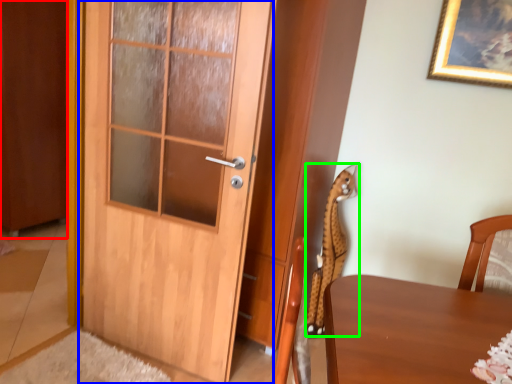
Question: Considering the real-world distances, which object is farthest from barn door (highlighted by a red box)? door (highlighted by a blue box) or animal (highlighted by a green box)?

Choices:
 (A) door
 (B) animal

Answer: (B)